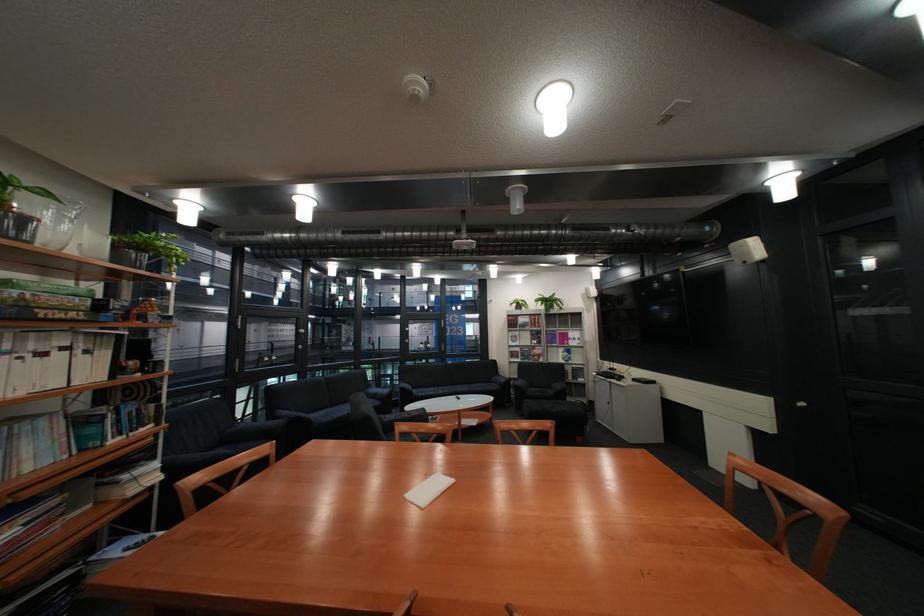
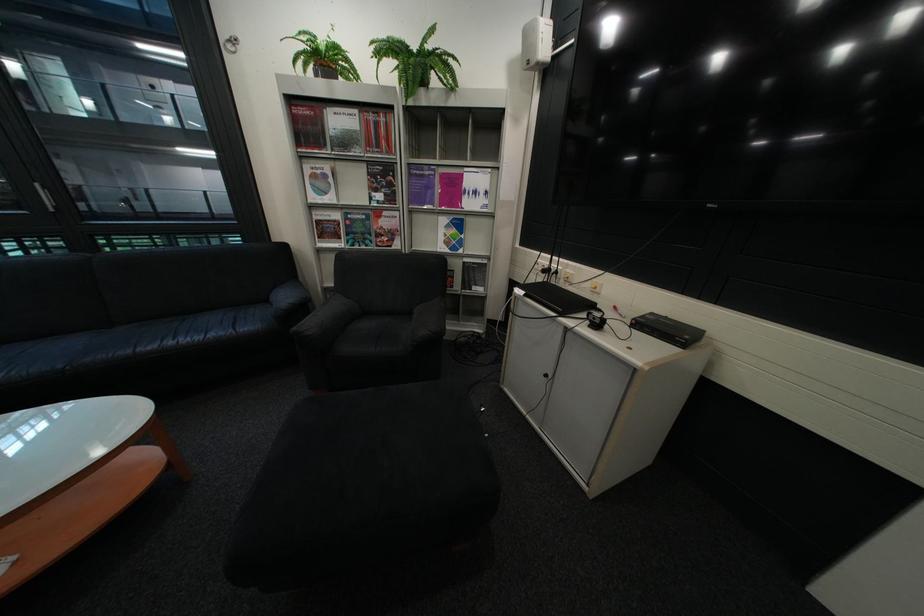
Find the pixel in the second image that matches (531,309) in the first image.

(333, 78)